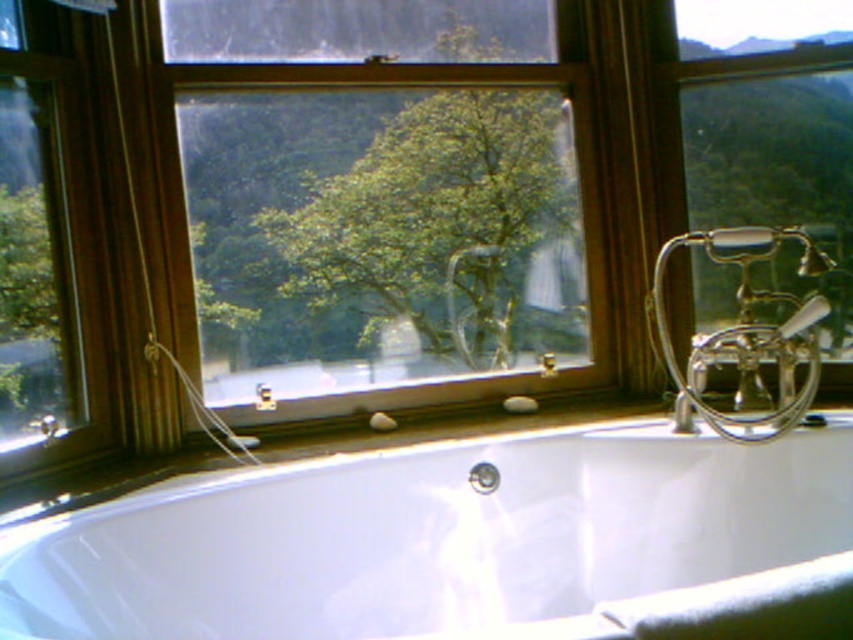
Between transparent glass window at center and metallic/reflective mountain at upper right, which one appears on the left side from the viewer's perspective?

Positioned to the left is transparent glass window at center.

Is point (297, 45) farther from camera compared to point (723, 186)?

No, it is not.

At what (x,y) coordinates should I click in order to perform the action: click on transparent glass window at center. Please return your answer as a coordinate pair (x, y). The image size is (853, 640). Looking at the image, I should click on (387, 200).

Which of these two, clear glass window at upper left or metallic/reflective mountain at upper right, stands shorter?

metallic/reflective mountain at upper right

Is point (73, 163) farther from viewer compared to point (734, 160)?

That is False.

Find the location of a particular element. Image resolution: width=853 pixels, height=640 pixels. clear glass window at upper left is located at coordinates (42, 241).

Is point (572, 141) less distant than point (24, 438)?

No, it is not.

Is transparent glass window at center wider than clear glass window at upper left?

Correct, the width of transparent glass window at center exceeds that of clear glass window at upper left.

Is point (581, 172) positioned before point (4, 156)?

No, it is behind (4, 156).

Identify the location of transparent glass window at center. The image size is (853, 640). (387, 200).